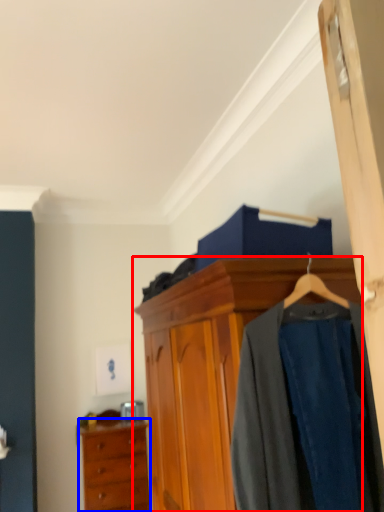
Question: Which object appears farthest to the camera in this image, cabinetry (highlighted by a red box) or chest of drawers (highlighted by a blue box)?

Choices:
 (A) cabinetry
 (B) chest of drawers

Answer: (B)